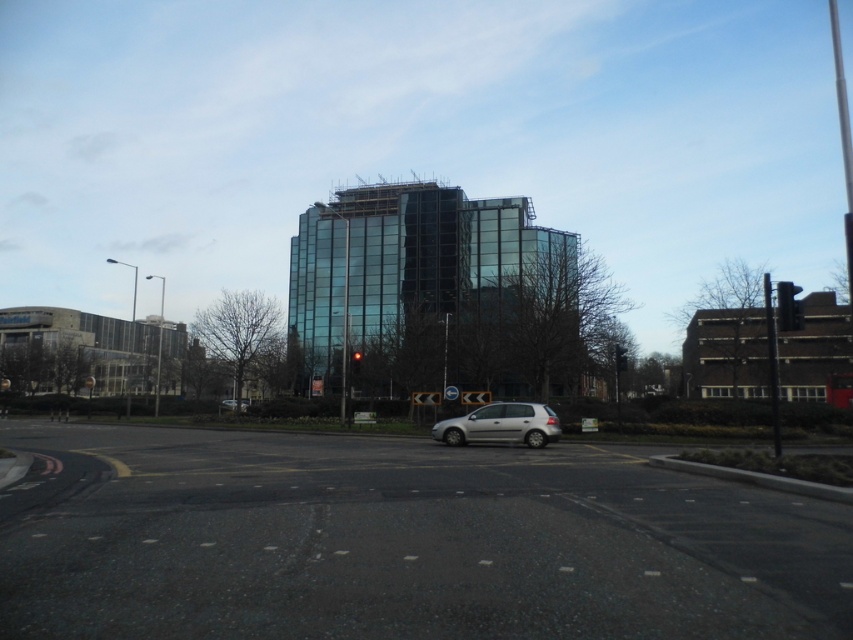
Question: Is black plastic traffic light at right positioned at the back of silver metallic car at center?

Choices:
 (A) yes
 (B) no

Answer: (B)

Question: Which point is farther from the camera taking this photo?

Choices:
 (A) (241, 410)
 (B) (467, 429)
 (C) (614, 348)
 (D) (576, 493)

Answer: (A)

Question: Does metallic traffic light at center have a lesser width compared to silver metallic car at center?

Choices:
 (A) yes
 (B) no

Answer: (A)

Question: Estimate the real-world distances between objects in this image. Which object is farther from the red glass traffic light at center?

Choices:
 (A) metallic traffic light at center
 (B) silver metallic hatchback at lower center

Answer: (A)

Question: Which point appears closest to the camera in this image?

Choices:
 (A) (549, 426)
 (B) (625, 358)
 (C) (357, 371)
 (D) (293, 481)

Answer: (D)

Question: Is black asphalt at center thinner than metallic traffic light at center?

Choices:
 (A) no
 (B) yes

Answer: (A)